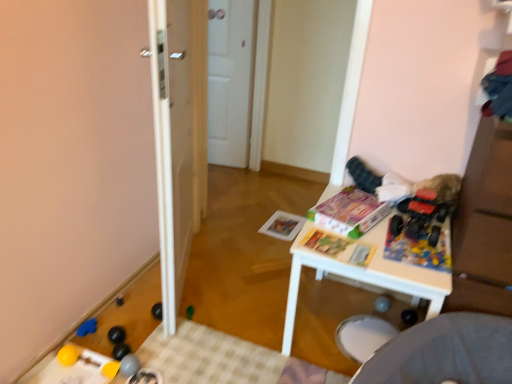
The height and width of the screenshot is (384, 512). Find the location of `vacant area in front of matte cardboard magazine at center, placed as the 2th magazine when sorted from back to front`. vacant area in front of matte cardboard magazine at center, placed as the 2th magazine when sorted from back to front is located at coordinates (388, 249).